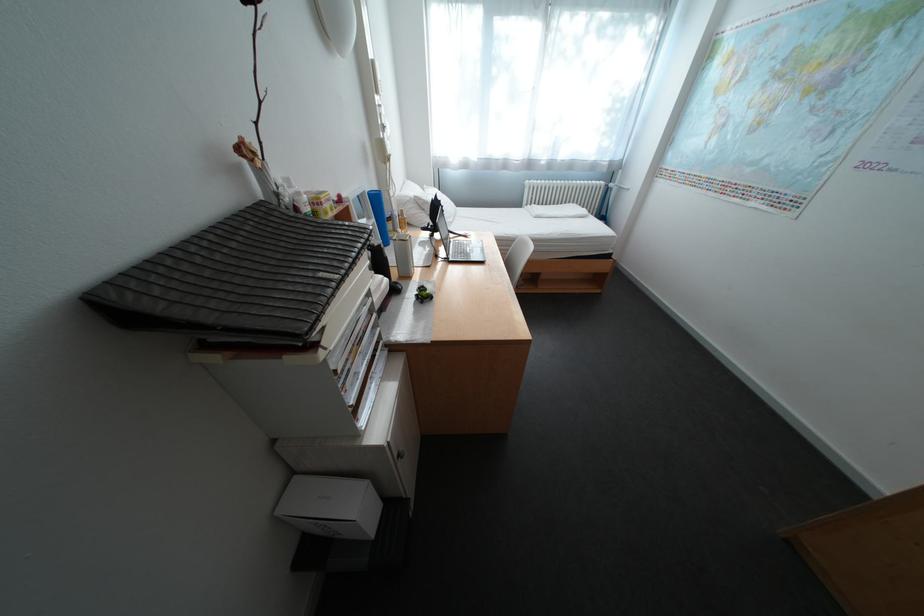
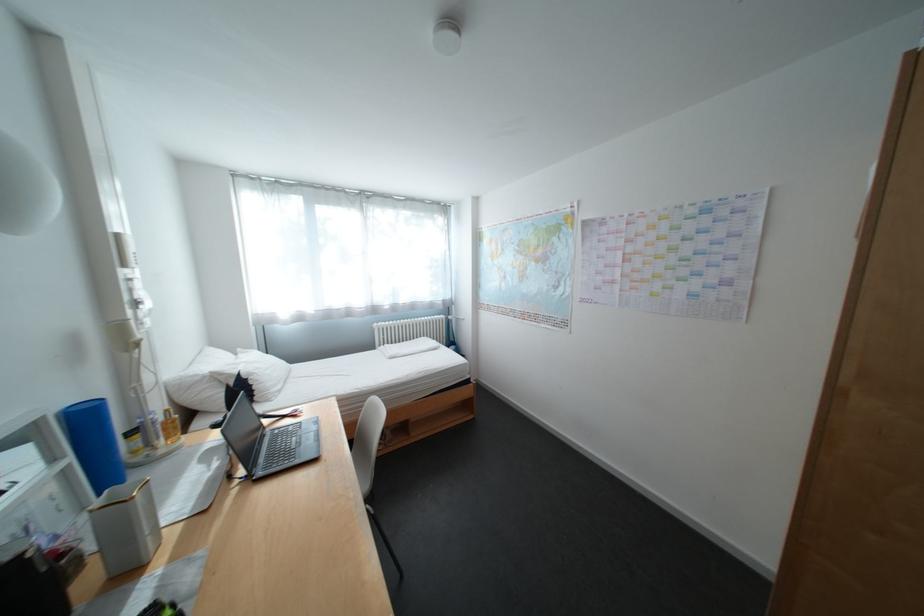
The first image is from the beginning of the video and the second image is from the end. How did the camera likely rotate when shooting the video?

The camera rotated toward right-up.